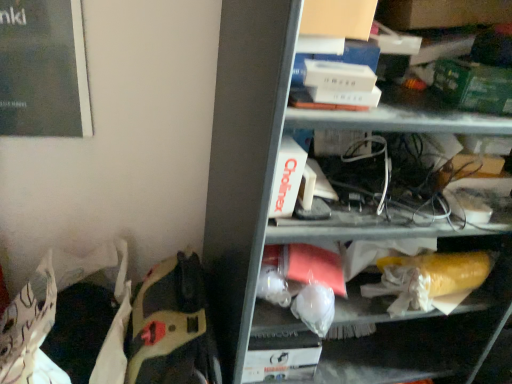
Question: Should I look upward or downward to see green matte paperback book at upper right?

Choices:
 (A) down
 (B) up

Answer: (B)